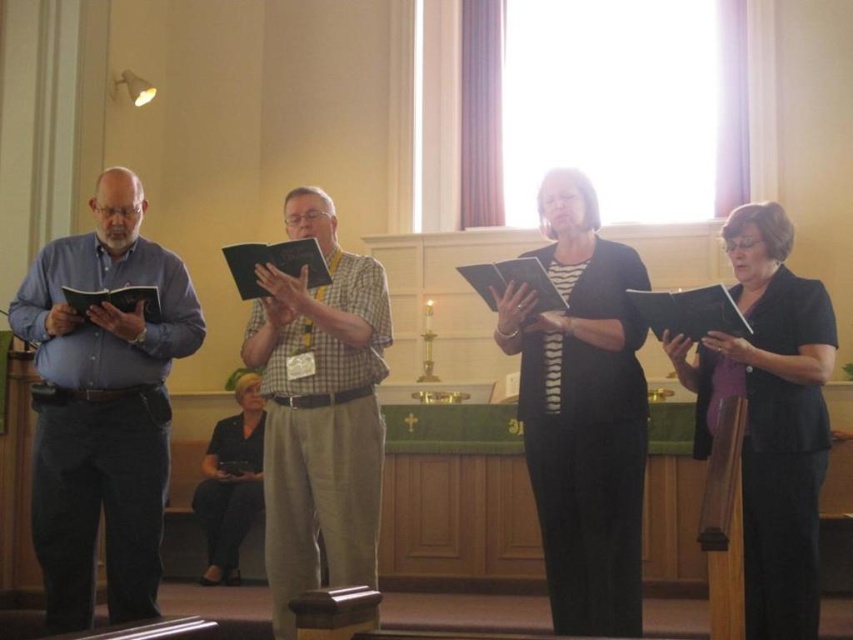
Question: Which object is closer to the camera taking this photo?

Choices:
 (A) black matte dress at center
 (B) checkered fabric shirt at center
 (C) black matte book at center

Answer: (C)

Question: Estimate the real-world distances between objects in this image. Which object is closer to the black matte book at center?

Choices:
 (A) black matte dress at center
 (B) checkered fabric shirt at center

Answer: (A)

Question: Among these objects, which one is nearest to the camera?

Choices:
 (A) blue shirt at left
 (B) black matte book at center

Answer: (B)

Question: Does black matte dress at center have a lesser width compared to black fabric book at lower left?

Choices:
 (A) no
 (B) yes

Answer: (A)

Question: Can you confirm if checkered fabric shirt at center is positioned to the left of black matte book at center?

Choices:
 (A) no
 (B) yes

Answer: (B)

Question: From the image, what is the correct spatial relationship of blue shirt at left in relation to black matte book at center?

Choices:
 (A) left
 (B) right

Answer: (A)